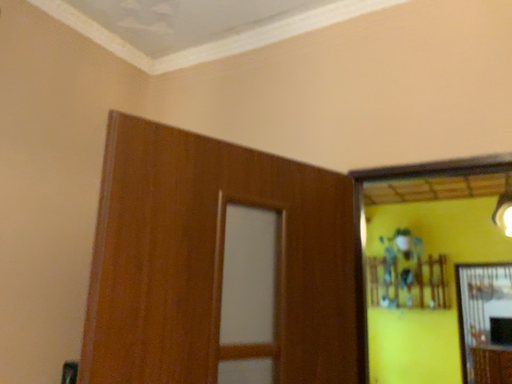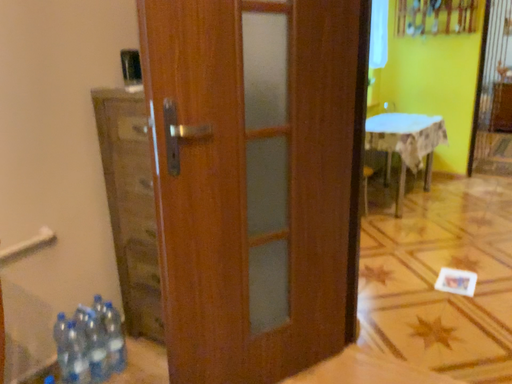
Question: How did the camera likely rotate when shooting the video?

Choices:
 (A) rotated upward
 (B) rotated downward

Answer: (B)